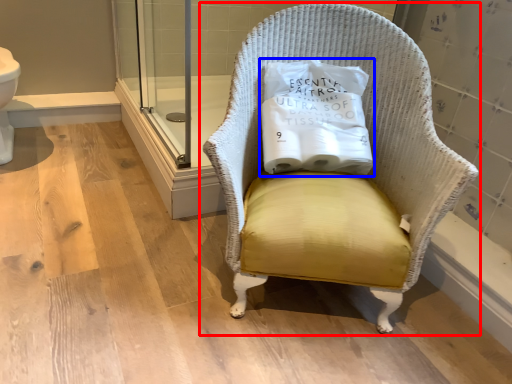
Question: Which point is further to the camera, chair (highlighted by a red box) or pillow (highlighted by a blue box)?

Choices:
 (A) chair
 (B) pillow

Answer: (B)